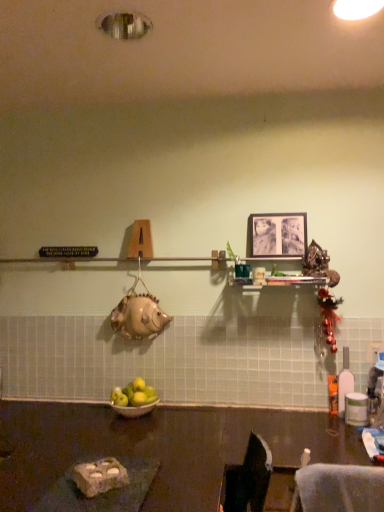
Question: Considering the relative positions of black matte picture frame at upper center and translucent plastic bottle at right in the image provided, is black matte picture frame at upper center in front of translucent plastic bottle at right?

Choices:
 (A) yes
 (B) no

Answer: (B)

Question: From a real-world perspective, does black matte picture frame at upper center sit lower than translucent plastic bottle at right?

Choices:
 (A) yes
 (B) no

Answer: (B)

Question: Does black matte picture frame at upper center have a lesser height compared to translucent plastic bottle at right?

Choices:
 (A) yes
 (B) no

Answer: (A)

Question: Is black matte picture frame at upper center bigger than translucent plastic bottle at right?

Choices:
 (A) yes
 (B) no

Answer: (B)

Question: From a real-world perspective, is black matte picture frame at upper center on translucent plastic bottle at right?

Choices:
 (A) yes
 (B) no

Answer: (A)

Question: Considering the positions of point (236, 408) and point (145, 386), is point (236, 408) closer or farther from the camera than point (145, 386)?

Choices:
 (A) farther
 (B) closer

Answer: (A)

Question: Considering their positions, is dark brown polished table at lower center located in front of or behind green matte apples at center?

Choices:
 (A) behind
 (B) front

Answer: (B)

Question: From the image's perspective, is dark brown polished table at lower center positioned above or below green matte apples at center?

Choices:
 (A) below
 (B) above

Answer: (A)

Question: Based on their sizes in the image, would you say dark brown polished table at lower center is bigger or smaller than green matte apples at center?

Choices:
 (A) small
 (B) big

Answer: (B)

Question: From the image's perspective, is silver metallic bowl at center above or below black matte picture frame at upper center?

Choices:
 (A) above
 (B) below

Answer: (B)

Question: Based on their sizes in the image, would you say silver metallic bowl at center is bigger or smaller than black matte picture frame at upper center?

Choices:
 (A) small
 (B) big

Answer: (B)

Question: Is silver metallic bowl at center to the left or to the right of black matte picture frame at upper center in the image?

Choices:
 (A) left
 (B) right

Answer: (A)

Question: From a real-world perspective, is silver metallic bowl at center positioned above or below black matte picture frame at upper center?

Choices:
 (A) above
 (B) below

Answer: (B)

Question: In the image, is translucent plastic bottle at right on the left side or the right side of green matte apples at center?

Choices:
 (A) right
 (B) left

Answer: (A)

Question: From the image's perspective, is translucent plastic bottle at right located above or below green matte apples at center?

Choices:
 (A) above
 (B) below

Answer: (A)